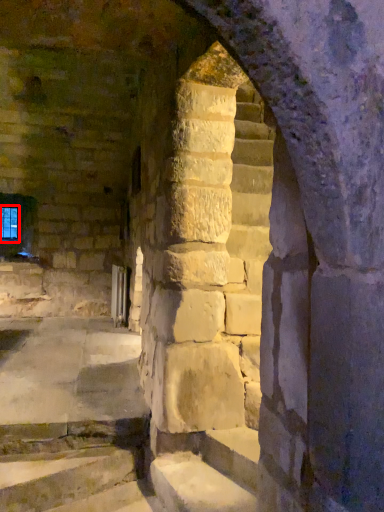
Question: In this image, where is glass window (annotated by the red box) located relative to stairwell?

Choices:
 (A) right
 (B) left

Answer: (B)